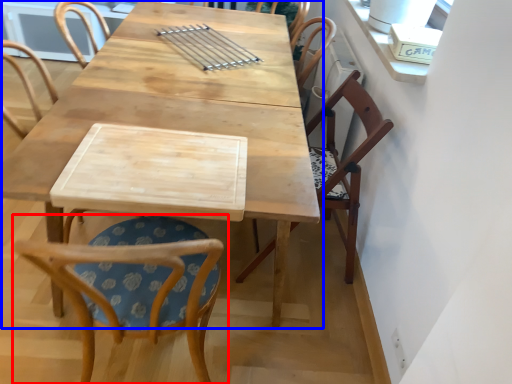
Question: Which point is closer to the camera, chair (highlighted by a red box) or table (highlighted by a blue box)?

Choices:
 (A) chair
 (B) table

Answer: (A)